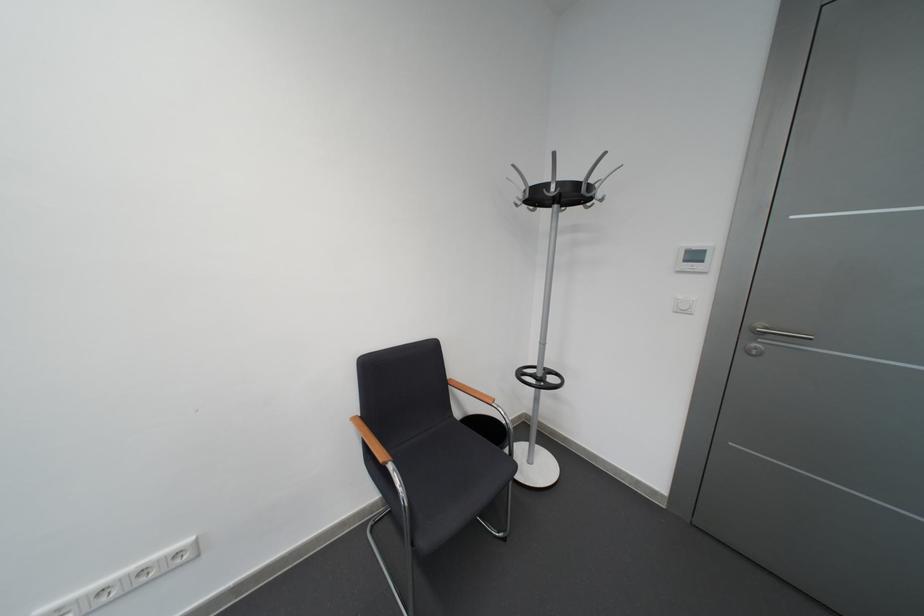
Which object does [123,581] point to?

It refers to a white light switch.